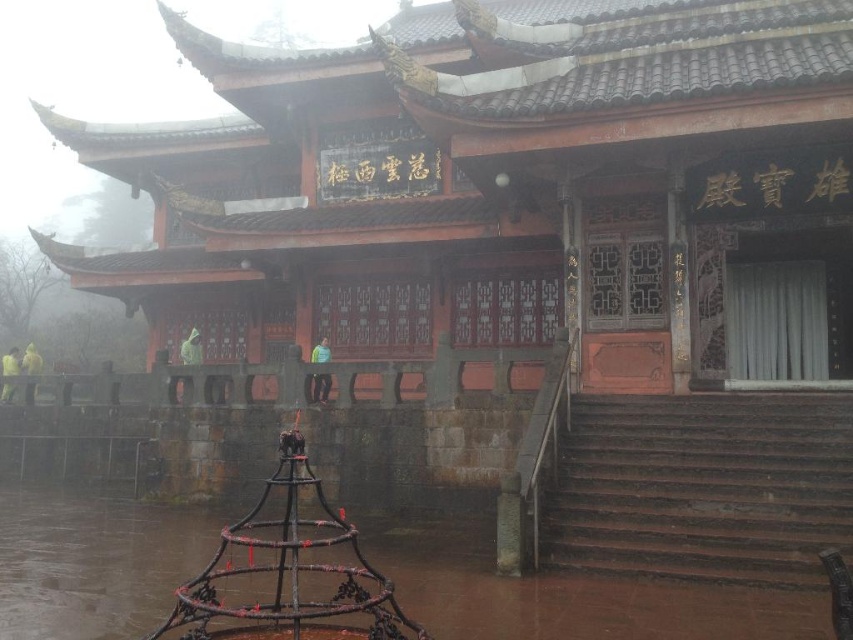
Question: Which object is the farthest from the yellow matte jacket at left?

Choices:
 (A) brown concrete stairs at lower right
 (B) yellow fabric person at center

Answer: (A)

Question: Is brown concrete stairs at lower right above yellow fabric person at left?

Choices:
 (A) no
 (B) yes

Answer: (A)

Question: Is the position of yellow fabric person at center less distant than that of yellow matte jacket at left?

Choices:
 (A) no
 (B) yes

Answer: (B)

Question: Which point is closer to the camera?

Choices:
 (A) yellow matte jacket at left
 (B) yellow fabric person at left

Answer: (B)

Question: Does brown concrete stairs at lower right have a smaller size compared to yellow matte jacket at left?

Choices:
 (A) yes
 (B) no

Answer: (A)

Question: Which point is farther from the camera taking this photo?

Choices:
 (A) (15, 348)
 (B) (33, 397)
 (C) (318, 390)

Answer: (A)